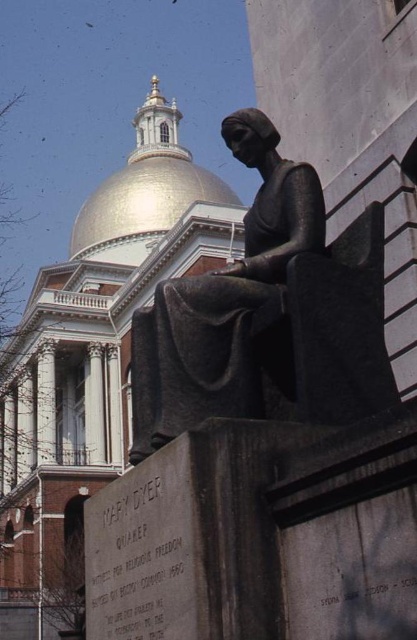
You are an architect evaluating the proportions of the bronze statue at center and the gold polished dome at upper center in the image. Which object appears larger in size?

The gold polished dome at upper center is larger than the bronze statue at center.

You are a tour guide leading a group to the gold polished dome at upper center. The bronze statue at center is in your path. Can you walk straight ahead to reach the dome without going around the statue?

The bronze statue at center is 39.86 meters away from the gold polished dome at upper center. Since the statue is directly in the path, you can walk straight ahead towards the gold polished dome at upper center as there is sufficient distance between them to navigate around the statue if needed.

You are standing in front of a grand building with a dome. You see a point marked at coordinates [228,307]. What object is located at that point?

The point at coordinates [228,307] marks the bronze statue at center.